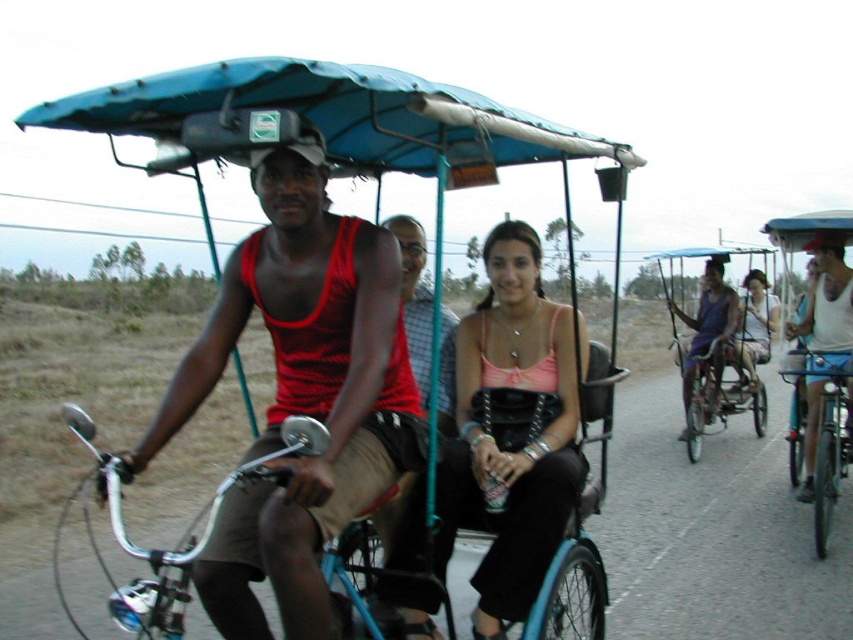
You are standing on the side of the road and see the matte blue rickshaw at center and the matte red tank top at center. Which object is positioned more to the right?

The matte blue rickshaw at center is positioned to the right of the matte red tank top at center, so it is more to the right.

You are a tour guide leading a group of tourists and need to ensure everyone stays within a safe distance of 40 feet. You notice the matte blue rickshaw at center and the matte red tank top at center. Are the two objects within the 40 feet safety distance?

The matte blue rickshaw at center is 37.34 feet from matte red tank top at center, so yes, they are within the 40 feet safety distance.

You are planning to take a photo of the blue matte tricycle at center from a specific location. The tricycle is at coordinates point 0.184, 0.397. If you want to ensure the tricycle is in the center of your photo, where should you position yourself relative to the tricycle?

To center the blue matte tricycle at center in your photo, you should position yourself directly in front of it along the line perpendicular to the tricycle at its center point. This ensures the tricycle is centered in the frame.